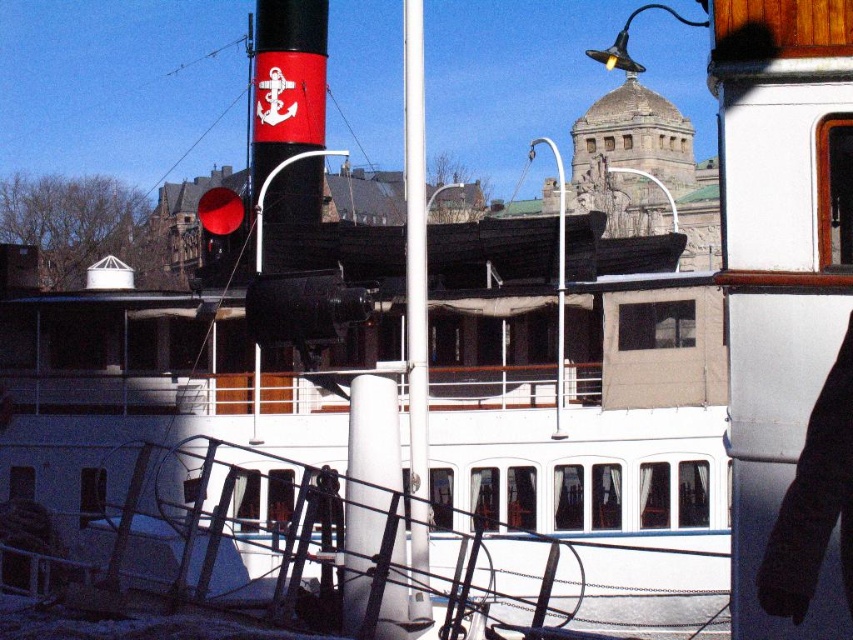
You are standing on the waterfront and want to take a photo of the historic steamboat. You notice two points marked in the image. The first point is at coordinates point (422, 600) and the second at point (563, 266). Which point is closer to your position?

Point (422, 600) is closer to the camera than point (563, 266), so the first point is closer to your position.

You are a photographer planning to take a photo of the historic steamboat and its waterfront setting. You notice two poles at the center of the scene. Which pole, the white glossy pole at center or the white metal pole at center, should you focus on if you want to capture the tallest object in the immediate foreground?

The white glossy pole at center is much taller than the white metal pole at center, so you should focus on the white glossy pole at center to capture the tallest object in the immediate foreground.